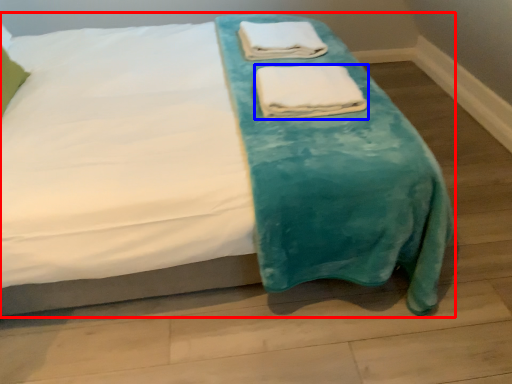
Question: Which object appears closest to the camera in this image, bed (highlighted by a red box) or towel (highlighted by a blue box)?

Choices:
 (A) bed
 (B) towel

Answer: (A)